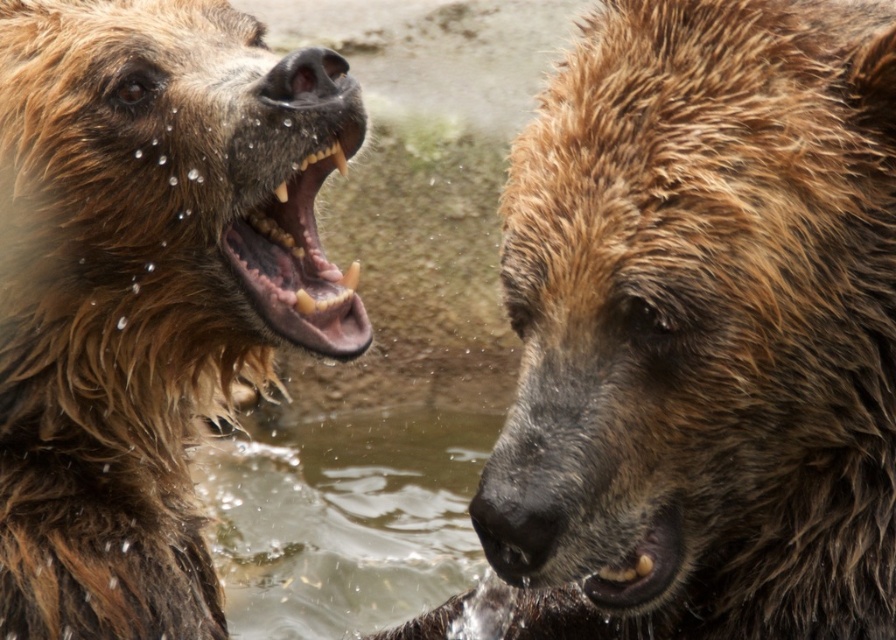
Question: Is wet fur bear at center further to the viewer compared to wet fur bear at left?

Choices:
 (A) no
 (B) yes

Answer: (A)

Question: Where is wet fur bear at left located in relation to brown fur mouth at left in the image?

Choices:
 (A) right
 (B) left

Answer: (B)

Question: Among these objects, which one is farthest from the camera?

Choices:
 (A) brown fur mouth at left
 (B) wet fur bear at center

Answer: (A)

Question: Which point appears farthest from the camera in this image?

Choices:
 (A) (823, 397)
 (B) (346, 291)

Answer: (B)

Question: Which object is the closest to the brown fur mouth at left?

Choices:
 (A) wet fur bear at left
 (B) wet fur bear at center

Answer: (A)

Question: Does wet fur bear at center appear over wet fur bear at left?

Choices:
 (A) no
 (B) yes

Answer: (A)